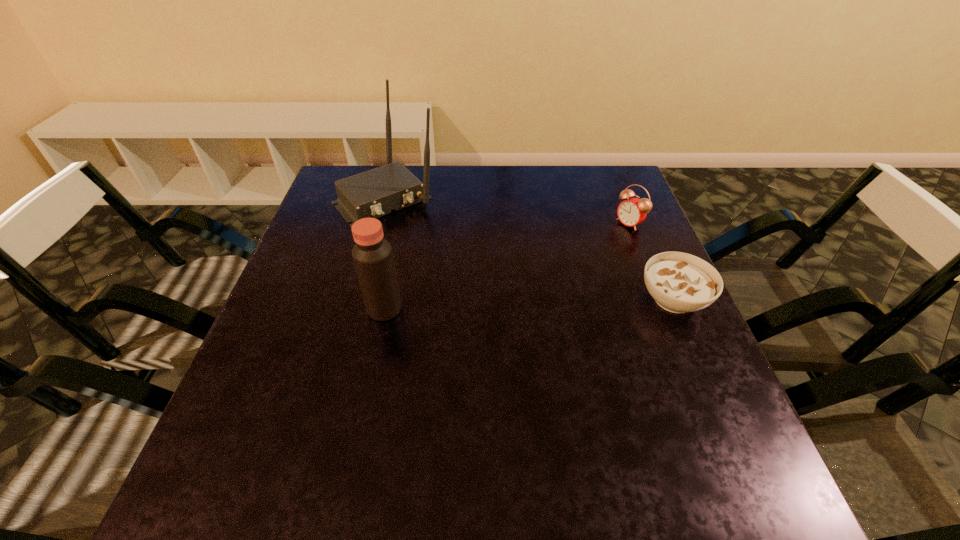
Image resolution: width=960 pixels, height=540 pixels. In the image, there is a desktop. What are the coordinates of `vacant area at the right edge` in the screenshot? It's located at (651, 321).

Identify the location of free region at the far right corner of the desktop. This screenshot has width=960, height=540. (599, 202).

Identify the location of vacant space that's between the router and the second shortest object. Image resolution: width=960 pixels, height=540 pixels. (508, 210).

Where is `free space between the alarm clock and the router`? The image size is (960, 540). free space between the alarm clock and the router is located at coordinates (508, 210).

Where is `vacant point located between the tallest object and the shortest object`? The width and height of the screenshot is (960, 540). vacant point located between the tallest object and the shortest object is located at coordinates (530, 248).

Find the location of a particular element. This screenshot has height=540, width=960. free spot between the vinegar and the shortest object is located at coordinates (529, 304).

At what (x,y) coordinates should I click in order to perform the action: click on unoccupied position between the alarm clock and the second tallest object. Please return your answer as a coordinate pair (x, y). This screenshot has height=540, width=960. Looking at the image, I should click on pyautogui.click(x=507, y=266).

Identify which object is the third closest to the soup bowl. Please provide its 2D coordinates. Your answer should be formatted as a tuple, i.e. [(x, y)], where the tuple contains the x and y coordinates of a point satisfying the conditions above.

[(373, 258)]

Identify the location of object that stands as the closest to the alarm clock. (679, 282).